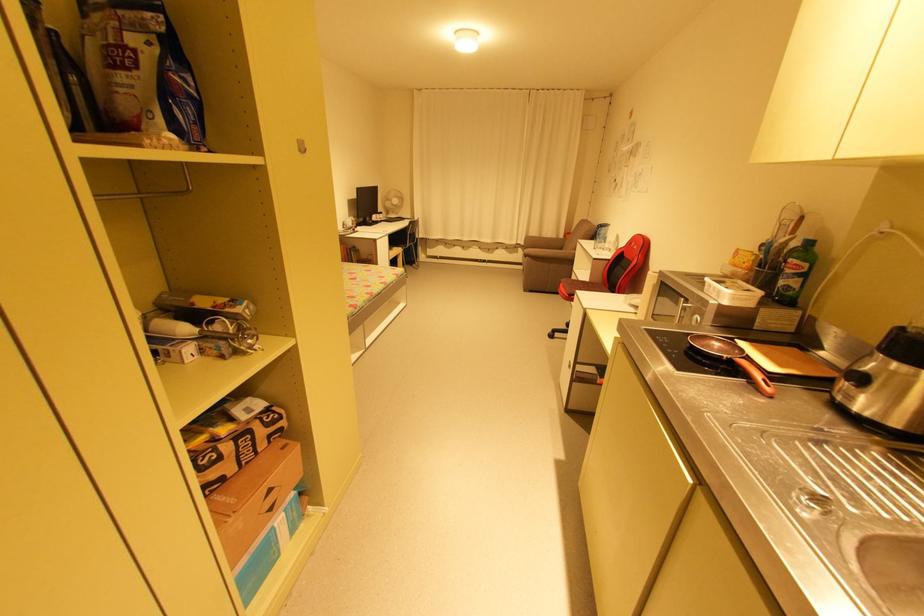
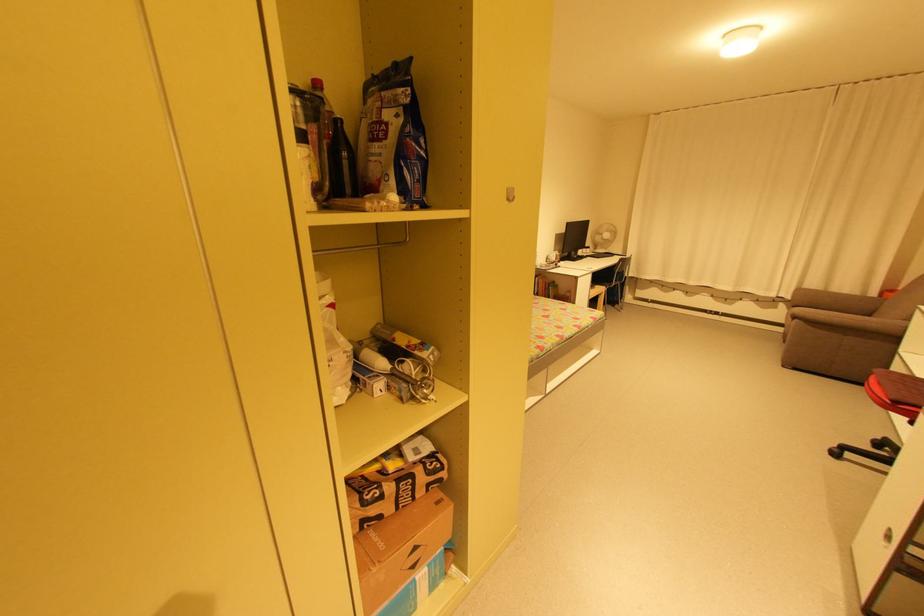
In the second image, find the point that corresponds to [305,152] in the first image.

(513, 200)